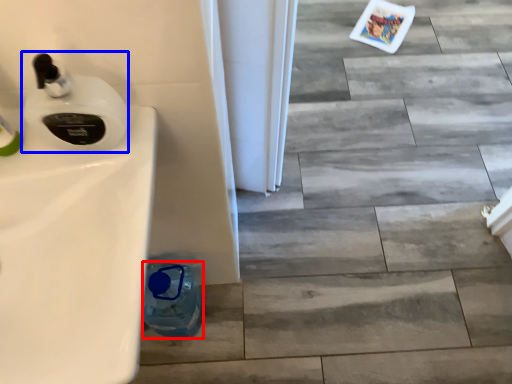
Question: Among these objects, which one is nearest to the camera, bottle (highlighted by a red box) or soap dispenser (highlighted by a blue box)?

Choices:
 (A) bottle
 (B) soap dispenser

Answer: (B)